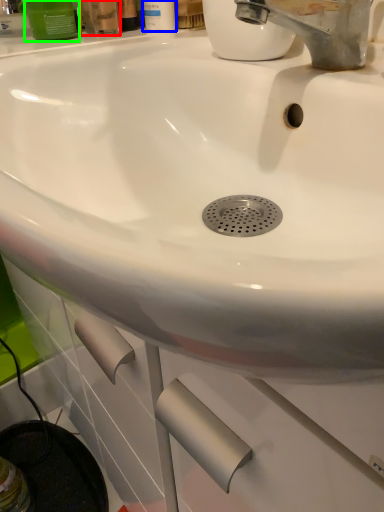
Question: Considering the real-world distances, which object is closest to mouthwash (highlighted by a red box)? mouthwash (highlighted by a blue box) or mouthwash (highlighted by a green box).

Choices:
 (A) mouthwash
 (B) mouthwash

Answer: (B)